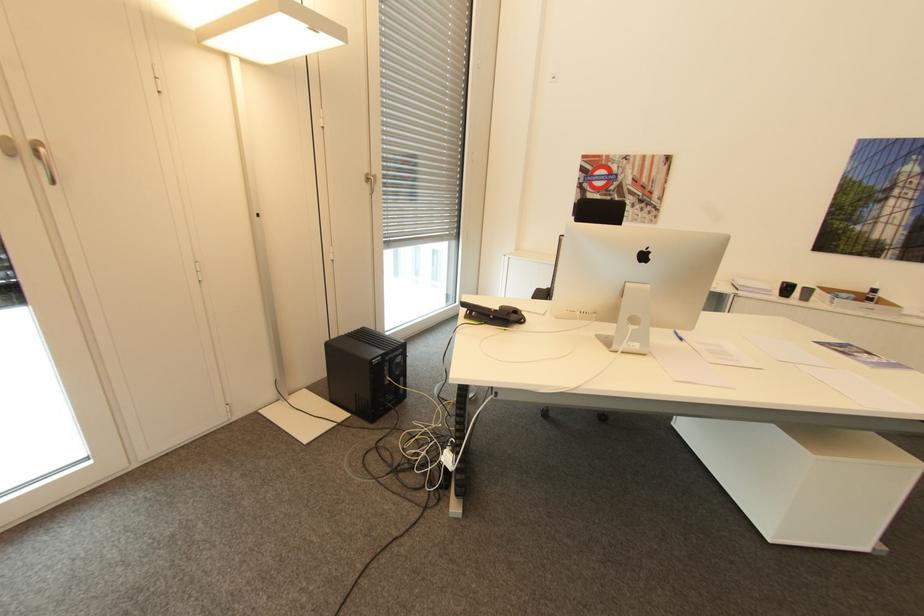
Which object does [785,289] point to?

It refers to a black cup.